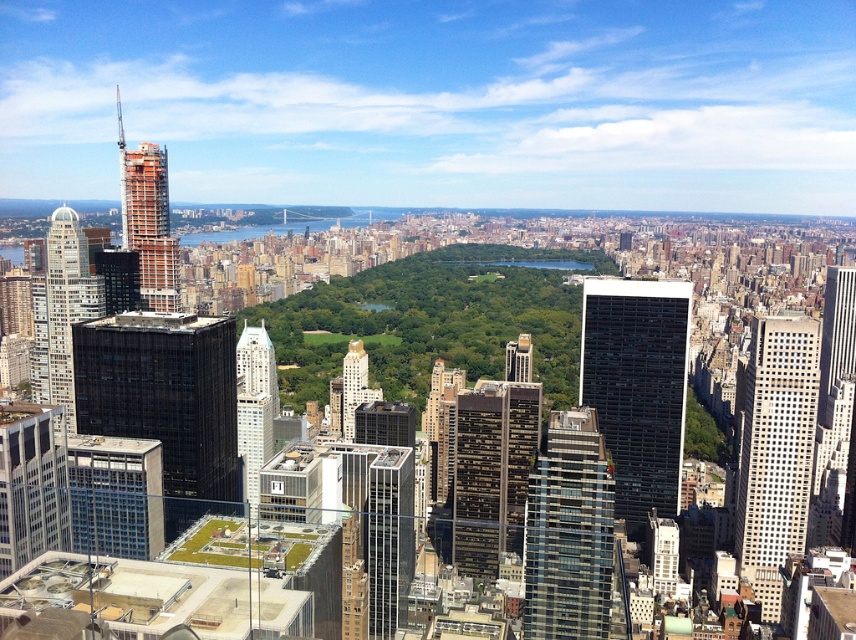
Which of these two, matte glass skyscraper at left or shiny glass skyscraper at center, stands shorter?

shiny glass skyscraper at center

Looking at this image, can you confirm if matte glass skyscraper at left is shorter than shiny glass skyscraper at center?

Incorrect, matte glass skyscraper at left's height does not fall short of shiny glass skyscraper at center's.

I want to click on matte glass skyscraper at left, so click(67, 301).

You are a GUI agent. You are given a task and a screenshot of the screen. Output one action in this format:
    pyautogui.click(x=<x>, y=<y>)
    Task: Click on the matte glass skyscraper at left
    The width and height of the screenshot is (856, 640).
    Given the screenshot: What is the action you would take?
    pyautogui.click(x=67, y=301)

Which is behind, point (123, 401) or point (749, 420)?

The point (749, 420) is behind.

Does black glass building at center-left have a larger size compared to white glass skyscraper at center-right?

Yes, black glass building at center-left is bigger than white glass skyscraper at center-right.

Does point (214, 477) come closer to viewer compared to point (795, 488)?

That is True.

Locate an element on the screen. This screenshot has width=856, height=640. black glass building at center-left is located at coordinates (165, 401).

Between white glass skyscraper at center-right and matte glass skyscraper at lower left, which one is positioned lower?

matte glass skyscraper at lower left

This screenshot has height=640, width=856. What do you see at coordinates (776, 452) in the screenshot?
I see `white glass skyscraper at center-right` at bounding box center [776, 452].

Locate an element on the screen. Image resolution: width=856 pixels, height=640 pixels. white glass skyscraper at center-right is located at coordinates (776, 452).